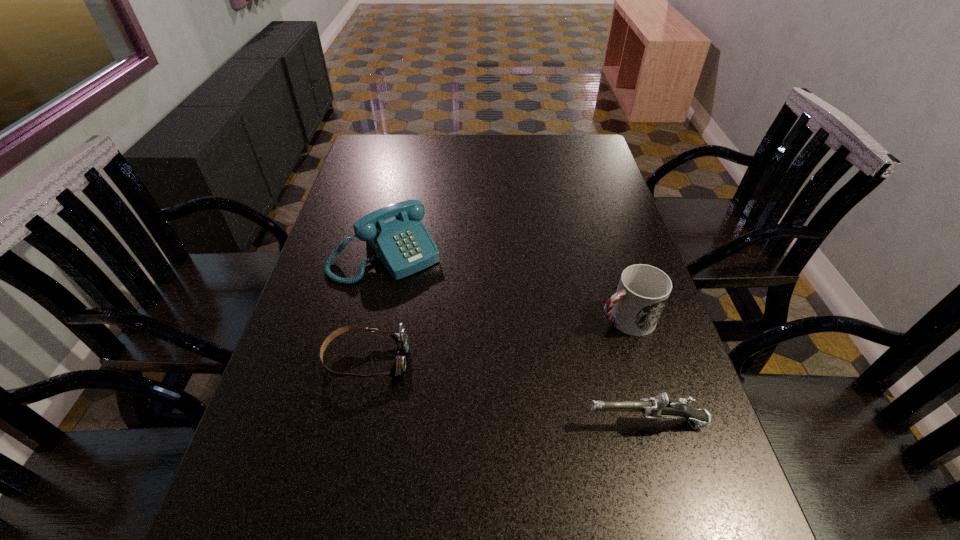
I want to click on free area in between the telephone and the cup, so click(x=505, y=286).

At what (x,y) coordinates should I click in order to perform the action: click on free space between the cup and the shortest object. Please return your answer as a coordinate pair (x, y). This screenshot has width=960, height=540. Looking at the image, I should click on [495, 339].

In order to click on vacant area between the second shortest object and the cup in this screenshot , I will do `click(636, 370)`.

The width and height of the screenshot is (960, 540). I want to click on vacant point located between the shortest object and the cup, so click(x=495, y=339).

In order to click on free space between the cup and the farthest object in this screenshot , I will do pyautogui.click(x=505, y=286).

This screenshot has height=540, width=960. Identify the location of object that ranks as the third closest to the cup. (401, 339).

Locate an element on the screen. The width and height of the screenshot is (960, 540). object that is the third closest to the cup is located at coordinates (401, 339).

You are a GUI agent. You are given a task and a screenshot of the screen. Output one action in this format:
    pyautogui.click(x=<x>, y=<y>)
    Task: Click on the blank area in the image that satisfies the following two spatial constraints: 1. on the front side of the telephone; 2. aimed along the barrel of the third tallest object
    Image resolution: width=960 pixels, height=540 pixels.
    Given the screenshot: What is the action you would take?
    pyautogui.click(x=348, y=423)